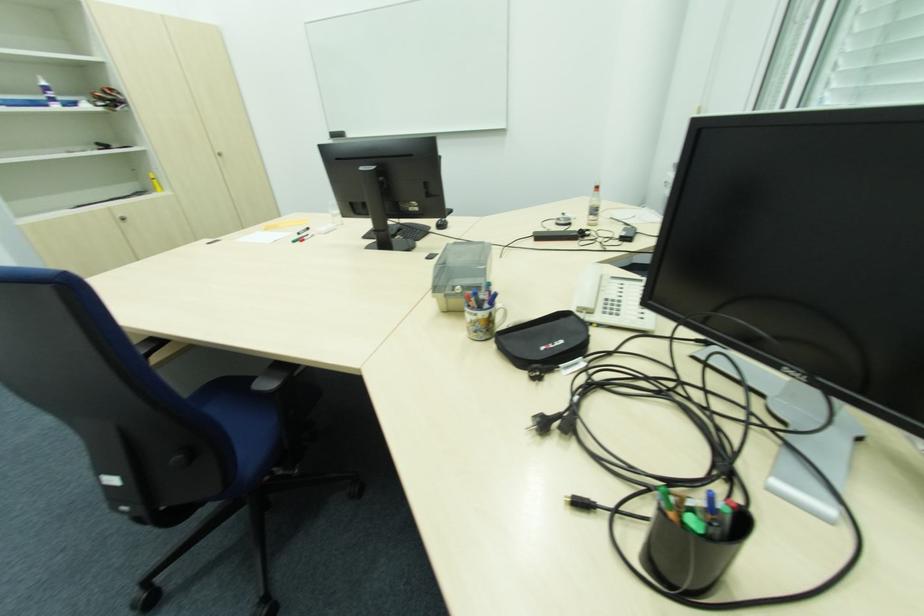
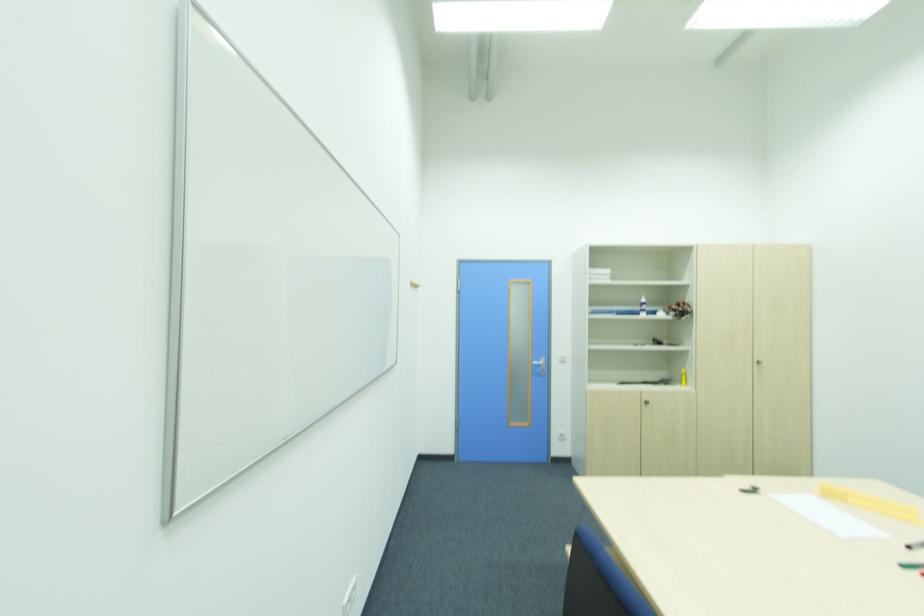
Find the pixel in the second image that matches (x=128, y=220) in the first image.

(650, 402)